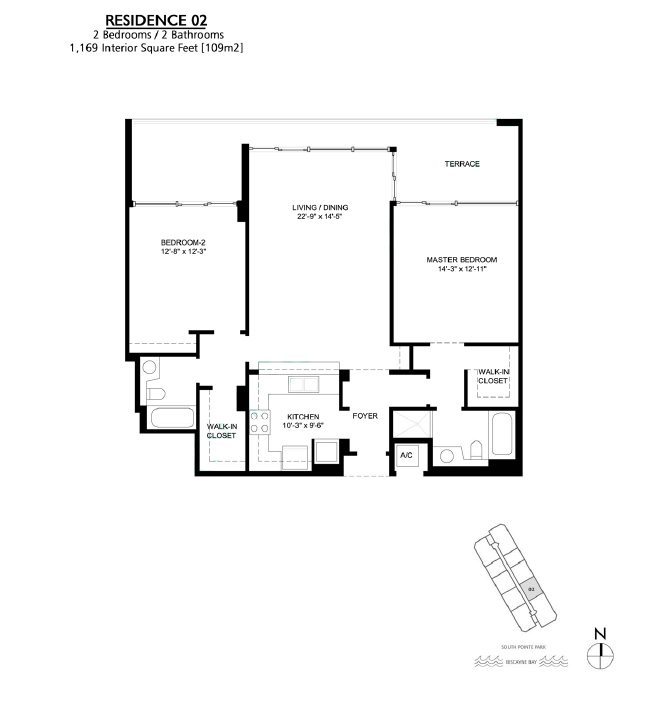
Identify the location of kitchen. The height and width of the screenshot is (701, 653). (311, 421).